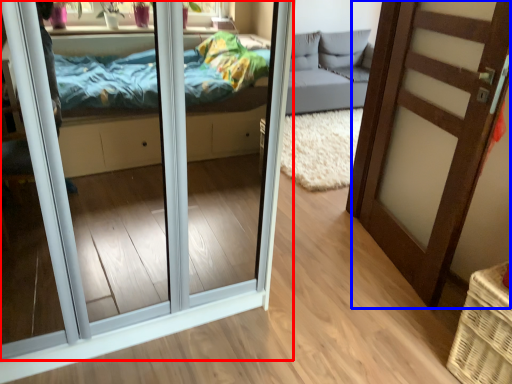
Question: Which of the following is the farthest to the observer, door (highlighted by a red box) or door (highlighted by a blue box)?

Choices:
 (A) door
 (B) door

Answer: (B)